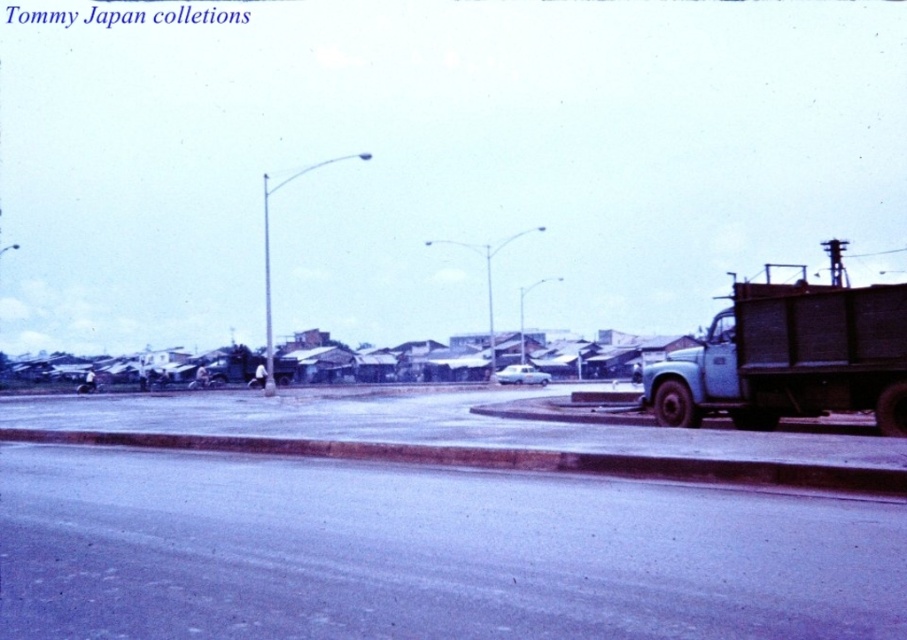
You are a GUI agent. You are given a task and a screenshot of the screen. Output one action in this format:
    pyautogui.click(x=<x>, y=<y>)
    Task: Click on the blue matte truck at right
    This screenshot has height=640, width=907.
    Given the screenshot: What is the action you would take?
    (790, 358)

Between blue matte truck at right and white glossy car at center, which one is positioned lower?

white glossy car at center

Does point (826, 339) come farther from viewer compared to point (527, 380)?

That is False.

What are the coordinates of `blue matte truck at right` in the screenshot? It's located at (790, 358).

Can you confirm if blue matte truck at right is shorter than smooth concrete curb at lower center?

No.

Can you confirm if blue matte truck at right is taller than smooth concrete curb at lower center?

Yes, blue matte truck at right is taller than smooth concrete curb at lower center.

Describe the element at coordinates (790, 358) in the screenshot. I see `blue matte truck at right` at that location.

This screenshot has width=907, height=640. In order to click on blue matte truck at right in this screenshot , I will do `click(790, 358)`.

Which is behind, point (881, 476) or point (541, 380)?

The point (541, 380) is more distant.

Can you confirm if smooth concrete curb at lower center is positioned above white glossy car at center?

Correct, smooth concrete curb at lower center is located above white glossy car at center.

This screenshot has width=907, height=640. What do you see at coordinates (505, 460) in the screenshot?
I see `smooth concrete curb at lower center` at bounding box center [505, 460].

Locate an element on the screen. The width and height of the screenshot is (907, 640). smooth concrete curb at lower center is located at coordinates (505, 460).